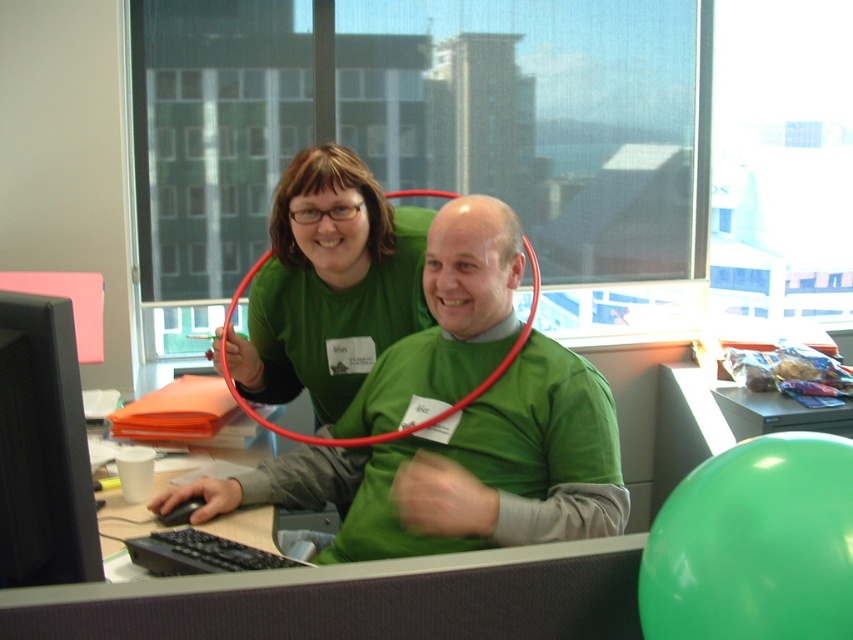
Question: Which point is closer to the camera taking this photo?

Choices:
 (A) (351, 412)
 (B) (6, 326)

Answer: (B)

Question: Can you confirm if green matte shirt at center is positioned to the left of black matte computer monitor at left?

Choices:
 (A) yes
 (B) no

Answer: (B)

Question: Among these points, which one is nearest to the camera?

Choices:
 (A) (59, 324)
 (B) (287, 476)

Answer: (A)

Question: Considering the relative positions of green matte shirt at center and black matte computer monitor at left in the image provided, where is green matte shirt at center located with respect to black matte computer monitor at left?

Choices:
 (A) below
 (B) above

Answer: (B)

Question: Can you confirm if green matte shirt at center is bigger than black matte computer monitor at left?

Choices:
 (A) no
 (B) yes

Answer: (B)